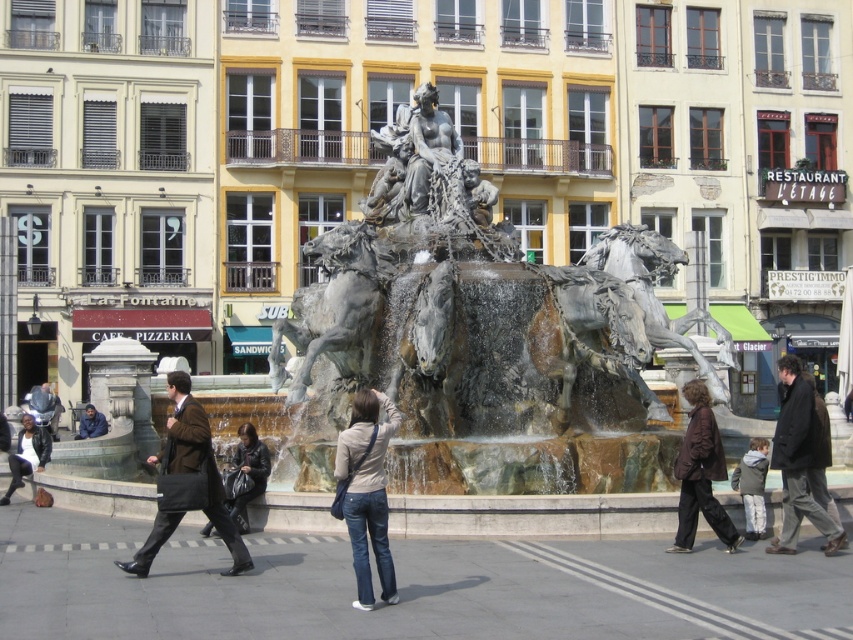
Is denim jeans at center to the left of matte black helmet at left from the viewer's perspective?

In fact, denim jeans at center is to the right of matte black helmet at left.

Based on the photo, between denim jeans at center and matte black helmet at left, which one appears on the right side from the viewer's perspective?

denim jeans at center is more to the right.

Does point (364, 552) come closer to viewer compared to point (38, 406)?

Yes, point (364, 552) is in front of point (38, 406).

At what (x,y) coordinates should I click in order to perform the action: click on denim jeans at center. Please return your answer as a coordinate pair (x, y). Looking at the image, I should click on (367, 492).

Between point (796, 452) and point (701, 404), which one is positioned in front?

Point (796, 452) is more forward.

Which is more to the right, dark brown coat at lower right or brown leather jacket at lower right?

dark brown coat at lower right is more to the right.

Which is behind, point (775, 545) or point (709, 493)?

The point (709, 493) is behind.

At what (x,y) coordinates should I click in order to perform the action: click on dark brown coat at lower right. Please return your answer as a coordinate pair (x, y). This screenshot has height=640, width=853. Looking at the image, I should click on (798, 461).

Who is positioned more to the right, matte black helmet at left or dark blue jacket at lower left?

dark blue jacket at lower left is more to the right.

Does matte black helmet at left have a larger size compared to dark blue jacket at lower left?

Indeed, matte black helmet at left has a larger size compared to dark blue jacket at lower left.

This screenshot has width=853, height=640. Find the location of `matte black helmet at left`. matte black helmet at left is located at coordinates coord(44,406).